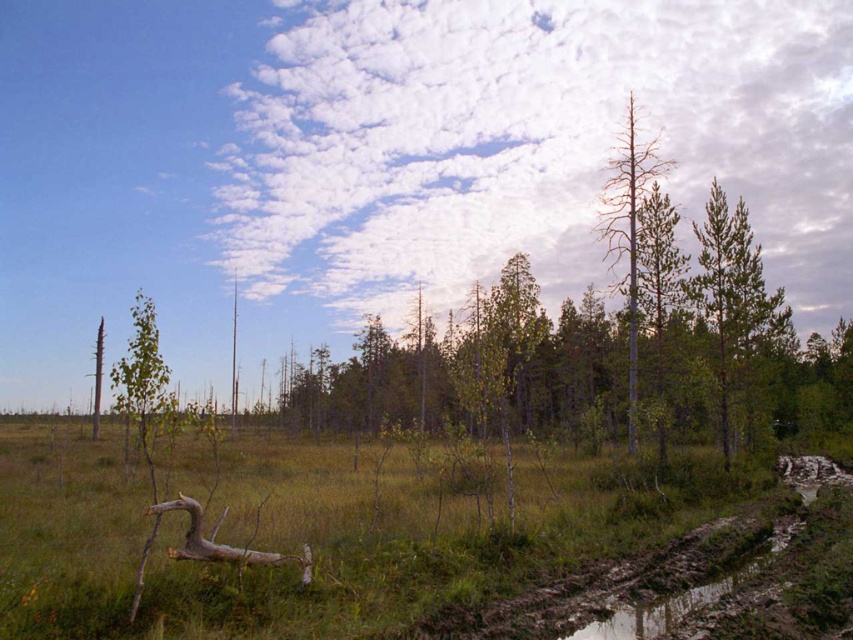
Does green matte tree at right come in front of brown bark tree at right?

No, green matte tree at right is behind brown bark tree at right.

Is green matte tree at right to the left of brown bark tree at right from the viewer's perspective?

Correct, you'll find green matte tree at right to the left of brown bark tree at right.

Between point (751, 392) and point (634, 253), which one is positioned in front?

Point (751, 392)

Where is `green matte tree at right`? The width and height of the screenshot is (853, 640). green matte tree at right is located at coordinates (735, 308).

Which is below, brown bark tree at right or smooth brown tree trunk at left?

smooth brown tree trunk at left

Describe the element at coordinates (628, 228) in the screenshot. I see `brown bark tree at right` at that location.

The height and width of the screenshot is (640, 853). I want to click on brown bark tree at right, so click(628, 228).

Which is in front, point (732, 225) or point (97, 358)?

Point (732, 225) is more forward.

Between green matte tree at right and smooth brown tree trunk at left, which one has less height?

smooth brown tree trunk at left is shorter.

Is point (714, 212) positioned before point (99, 385)?

Yes, it is.

Where is `green matte tree at right`? The image size is (853, 640). green matte tree at right is located at coordinates (735, 308).